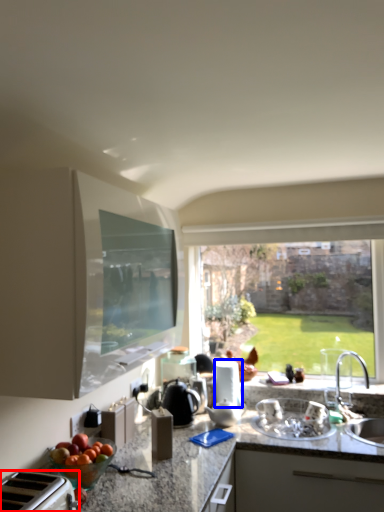
Question: Which of the following is the closest to the observer, appliance (highlighted by a red box) or appliance (highlighted by a blue box)?

Choices:
 (A) appliance
 (B) appliance

Answer: (A)